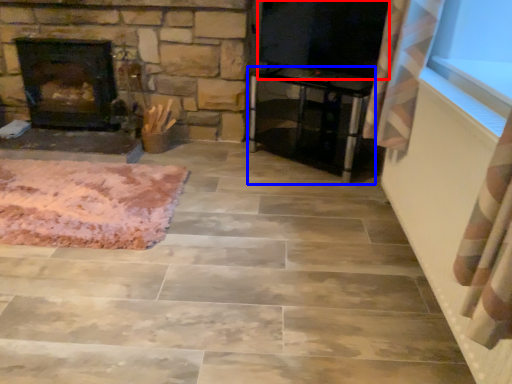
Question: Among these objects, which one is farthest to the camera, window screen (highlighted by a red box) or furniture (highlighted by a blue box)?

Choices:
 (A) window screen
 (B) furniture

Answer: (B)